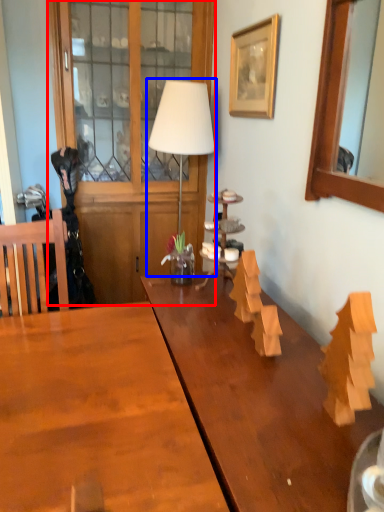
Question: Which point is further to the camera, dresser (highlighted by a red box) or table lamp (highlighted by a blue box)?

Choices:
 (A) dresser
 (B) table lamp

Answer: (A)